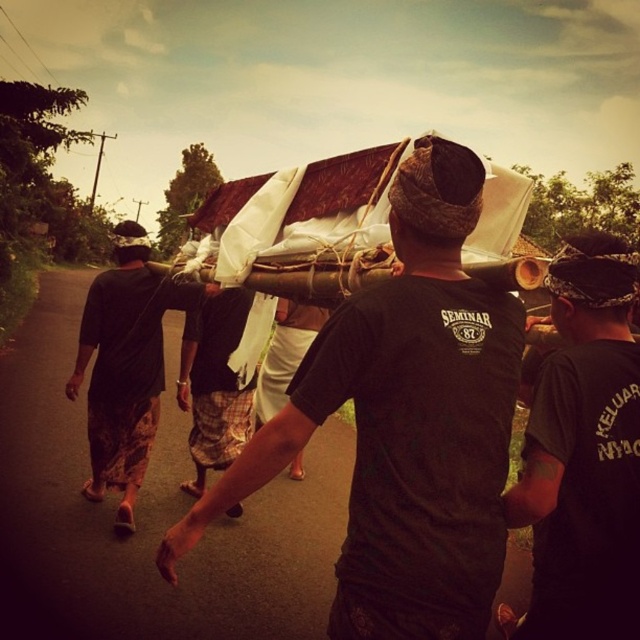
Question: Which point is closer to the camera?

Choices:
 (A) dark brown woven cloth at center
 (B) black woven hat at upper left
 (C) brown woven basket at center
 (D) brown woven hat at center

Answer: (C)

Question: Which of the following is the farthest from the observer?

Choices:
 (A) (426, 176)
 (B) (124, 314)
 (C) (616, 380)

Answer: (B)

Question: Does black fabric at center have a greater width compared to brown woven hat at center?

Choices:
 (A) no
 (B) yes

Answer: (B)

Question: Does black fabric at center have a larger size compared to black woven hat at upper left?

Choices:
 (A) yes
 (B) no

Answer: (B)

Question: Is brown woven hat at center further to the viewer compared to black woven hat at upper left?

Choices:
 (A) yes
 (B) no

Answer: (B)

Question: Considering the real-world distances, which object is closest to the black woven hat at upper left?

Choices:
 (A) dark brown woven cloth at center
 (B) black fabric at center

Answer: (B)